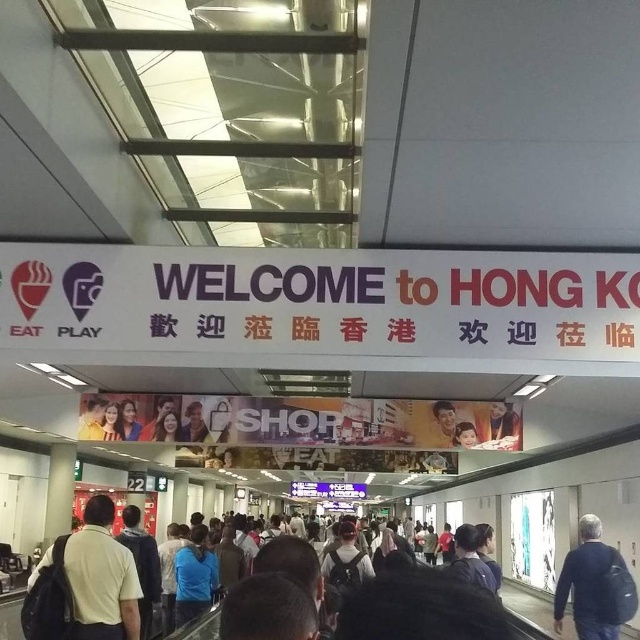
You are at an airport and need to locate your belongings. You remember leaving a light brown backpack at center and a light brown leather jacket at center. According to the scene, which item is positioned to the right of the other?

The light brown backpack at center is to the right of the light brown leather jacket at center.

You are a traveler who just arrived at the airport and see both the dark blue jacket at lower right and the light brown leather jacket at center. Which jacket is bigger in size?

The dark blue jacket at lower right is larger in size than the light brown leather jacket at center.